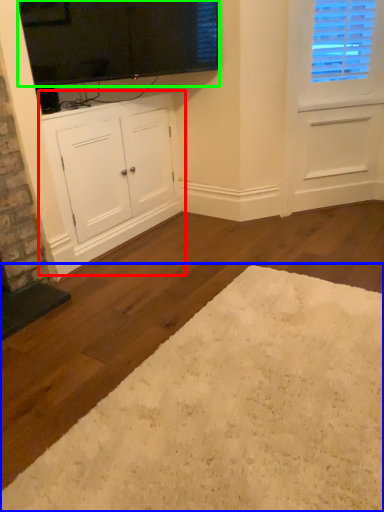
Question: Which object is the closest to the cabinetry (highlighted by a red box)? Choose among these: plain (highlighted by a blue box) or window screen (highlighted by a green box).

Choices:
 (A) plain
 (B) window screen

Answer: (B)